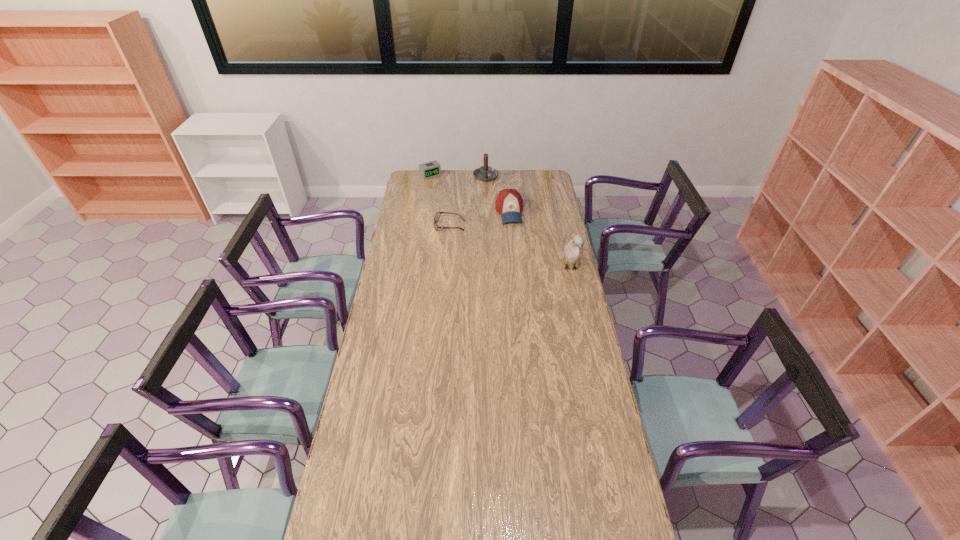
Image resolution: width=960 pixels, height=540 pixels. I want to click on free space between the sunglasses and the alarm clock, so click(440, 200).

At what (x,y) coordinates should I click in order to perform the action: click on vacant point located between the alarm clock and the candle. Please return your answer as a coordinate pair (x, y). The width and height of the screenshot is (960, 540). Looking at the image, I should click on [458, 176].

Identify the location of free spot between the alarm clock and the fourth shortest object. Image resolution: width=960 pixels, height=540 pixels. (458, 176).

Image resolution: width=960 pixels, height=540 pixels. Find the location of `free spot between the baseball cap and the sunglasses`. free spot between the baseball cap and the sunglasses is located at coordinates (480, 219).

At what (x,y) coordinates should I click in order to perform the action: click on vacant point located between the sunglasses and the fourth tallest object. Please return your answer as a coordinate pair (x, y). Image resolution: width=960 pixels, height=540 pixels. Looking at the image, I should click on (440, 200).

Find the location of a particular element. The image size is (960, 540). vacant area that lies between the third shortest object and the sunglasses is located at coordinates 480,219.

The width and height of the screenshot is (960, 540). What are the coordinates of `free space that is in between the candle and the shortest object` in the screenshot? It's located at (468, 201).

You are a GUI agent. You are given a task and a screenshot of the screen. Output one action in this format:
    pyautogui.click(x=<x>, y=<y>)
    Task: Click on the free spot between the third shortest object and the rightmost object
    The image size is (960, 540).
    Given the screenshot: What is the action you would take?
    pyautogui.click(x=540, y=240)

At what (x,y) coordinates should I click in order to perform the action: click on unoccupied area between the shortest object and the second shortest object. Please return your answer as a coordinate pair (x, y). This screenshot has height=540, width=960. Looking at the image, I should click on (440, 200).

Image resolution: width=960 pixels, height=540 pixels. What are the coordinates of `the fourth closest object to the shortest object` in the screenshot? It's located at (573, 252).